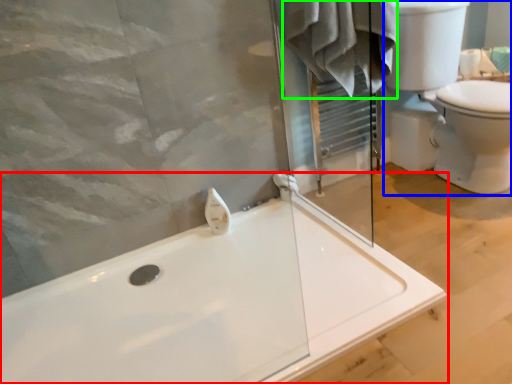
Question: Which object is positioned farthest from bathtub (highlighted by a red box)? Select from sink (highlighted by a blue box) and bathrobe (highlighted by a green box).

Choices:
 (A) sink
 (B) bathrobe

Answer: (A)